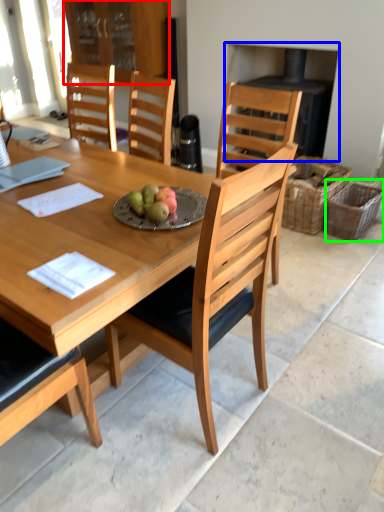
Question: Considering the real-world distances, which object is closest to cabinetry (highlighted by a red box)? fireplace (highlighted by a blue box) or picnic basket (highlighted by a green box).

Choices:
 (A) fireplace
 (B) picnic basket

Answer: (A)